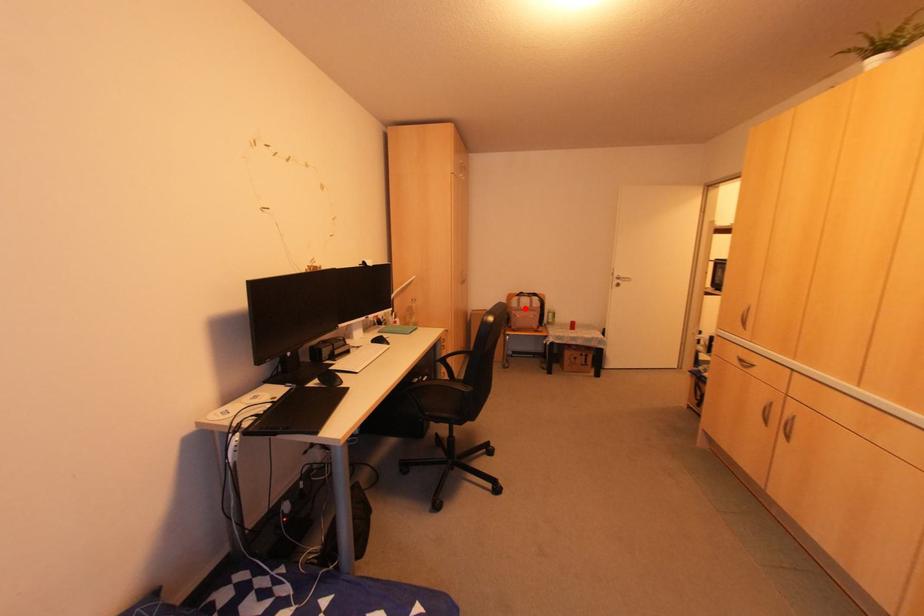
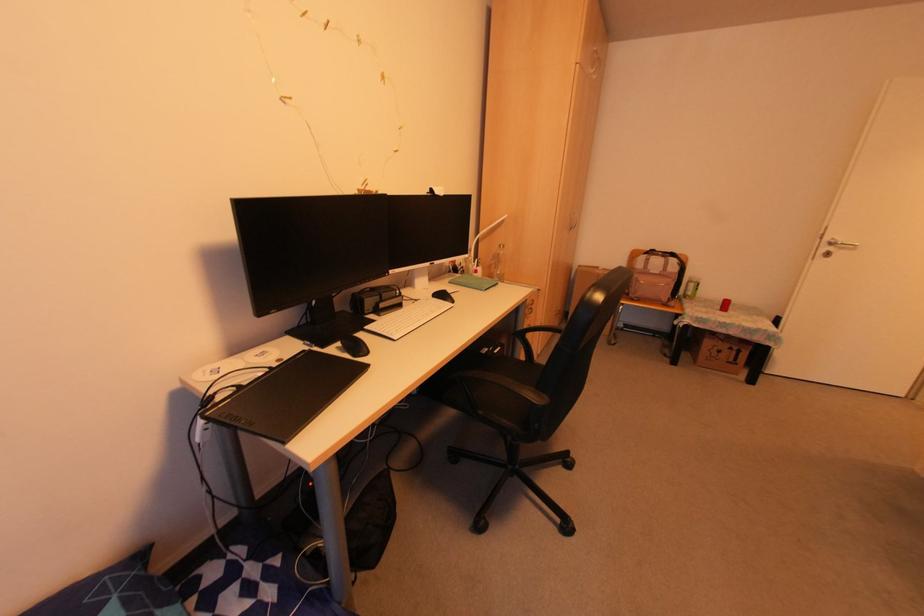
The point at the highlighted location is marked in the first image. Where is the corresponding point in the second image?

(655, 273)